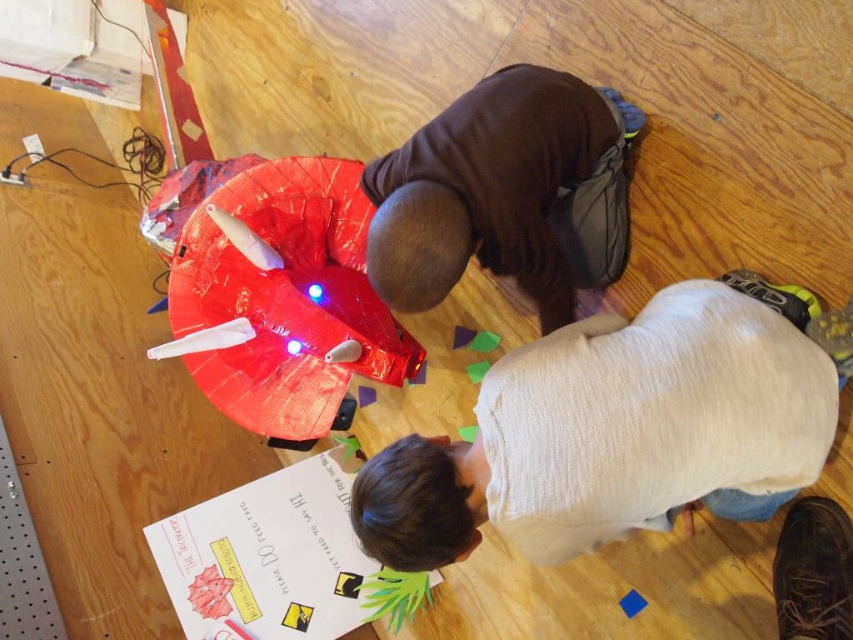
Question: Which of the following is the closest to the observer?

Choices:
 (A) brown matte shirt at center
 (B) shiny plastic toy at center

Answer: (A)

Question: Can you confirm if light beige sweater at lower center is bigger than shiny plastic toy at center?

Choices:
 (A) no
 (B) yes

Answer: (A)

Question: Which of the following is the closest to the observer?

Choices:
 (A) light beige sweater at lower center
 (B) brown matte shirt at center

Answer: (A)

Question: Does light beige sweater at lower center have a smaller size compared to shiny plastic toy at center?

Choices:
 (A) yes
 (B) no

Answer: (A)

Question: Can you confirm if light beige sweater at lower center is positioned to the right of brown matte shirt at center?

Choices:
 (A) yes
 (B) no

Answer: (A)

Question: Which object is closer to the camera taking this photo?

Choices:
 (A) brown matte shirt at center
 (B) light beige sweater at lower center
 (C) shiny plastic toy at center

Answer: (B)